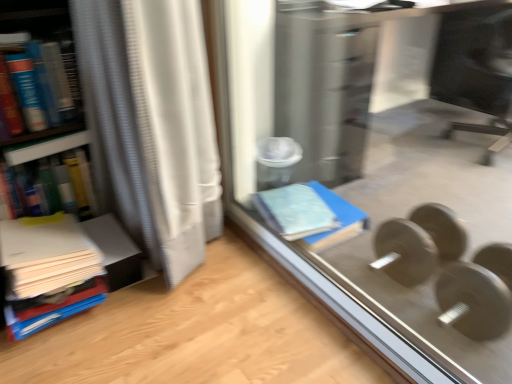
Where is `vacant space to the left of metallic gray dumbbell at lower right, the first dumbbell in the back-to-front sequence`? vacant space to the left of metallic gray dumbbell at lower right, the first dumbbell in the back-to-front sequence is located at coordinates (357, 259).